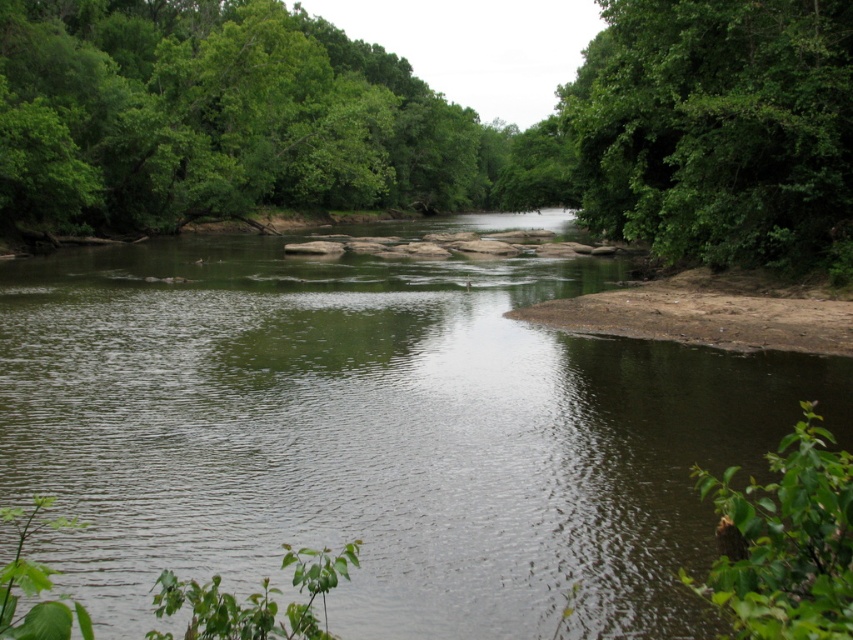
Is point (265, 435) farther from camera compared to point (547, 134)?

No, (265, 435) is closer to viewer.

Does point (25, 280) lie in front of point (730, 20)?

No, it is behind (730, 20).

At what (x,y) coordinates should I click in order to perform the action: click on green smooth water at center. Please return your answer as a coordinate pair (x, y). The image size is (853, 640). Looking at the image, I should click on tap(375, 435).

Does green leafy tree at center lie in front of green leafy tree at upper right?

No, it is not.

Which is more to the right, green leafy tree at center or green leafy tree at upper right?

From the viewer's perspective, green leafy tree at upper right appears more on the right side.

What are the coordinates of `green leafy tree at center` in the screenshot? It's located at click(434, 124).

This screenshot has height=640, width=853. I want to click on green leafy tree at center, so click(434, 124).

Measure the distance between green smooth water at center and camera.

A distance of 7.36 meters exists between green smooth water at center and camera.

Between point (506, 387) and point (787, 60), which one is positioned behind?

The point (787, 60) is behind.

Where is `green smooth water at center`? This screenshot has width=853, height=640. green smooth water at center is located at coordinates (375, 435).